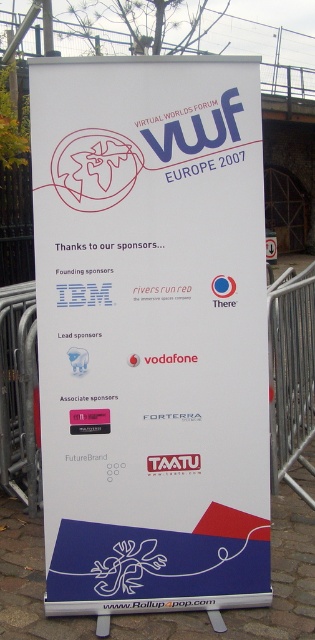
Question: Can you confirm if white paper sign at center is wider than metal barricade at right?

Choices:
 (A) no
 (B) yes

Answer: (B)

Question: Can you confirm if white paper sign at center is positioned to the right of metal barricade at right?

Choices:
 (A) no
 (B) yes

Answer: (A)

Question: Estimate the real-world distances between objects in this image. Which object is closer to the white paper sign at center?

Choices:
 (A) metal at upper center
 (B) metal barricade at right

Answer: (B)

Question: Which of the following is the farthest from the observer?

Choices:
 (A) metal at upper center
 (B) metal barricade at right

Answer: (A)

Question: Does white paper sign at center lie in front of metal barricade at right?

Choices:
 (A) no
 (B) yes

Answer: (B)

Question: Which point appears farthest from the camera in this image?

Choices:
 (A) (207, 74)
 (B) (279, 433)

Answer: (B)